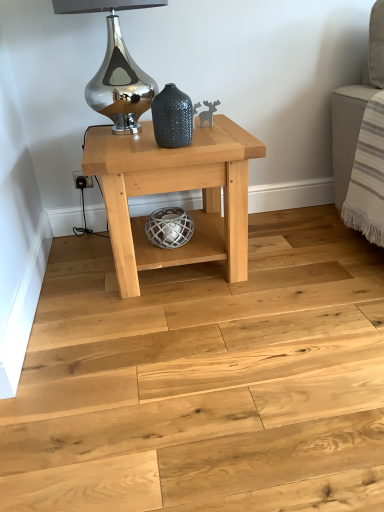
Identify the location of vacant space in front of natural wood table at center. The height and width of the screenshot is (512, 384). (179, 340).